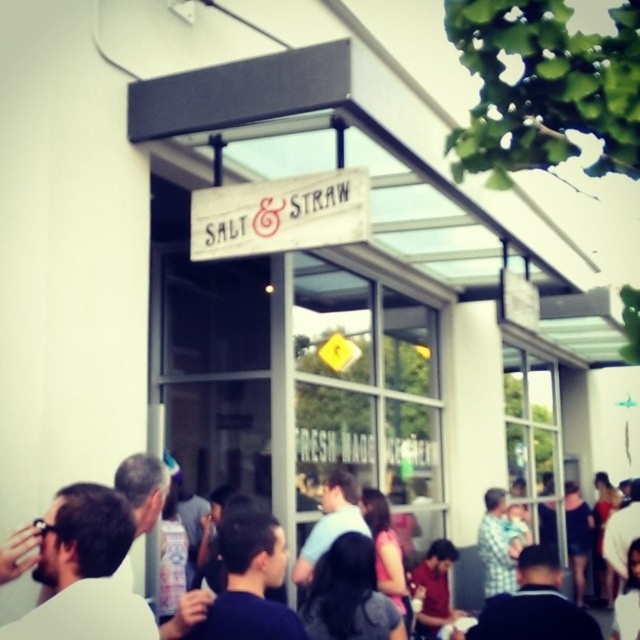
Question: Among these objects, which one is farthest from the camera?

Choices:
 (A) white wood sign at center
 (B) dark blue shirt at center

Answer: (A)

Question: Can you confirm if white wood sign at center is thinner than dark blue shirt at center?

Choices:
 (A) yes
 (B) no

Answer: (B)

Question: Does white wood sign at center lie in front of dark blue shirt at center?

Choices:
 (A) yes
 (B) no

Answer: (B)

Question: Which point is farther from the camera taking this photo?

Choices:
 (A) (257, 184)
 (B) (3, 573)

Answer: (A)

Question: Which of the following is the closest to the observer?

Choices:
 (A) (230, 189)
 (B) (188, 604)

Answer: (B)

Question: Is white wood sign at center smaller than dark blue shirt at center?

Choices:
 (A) yes
 (B) no

Answer: (B)